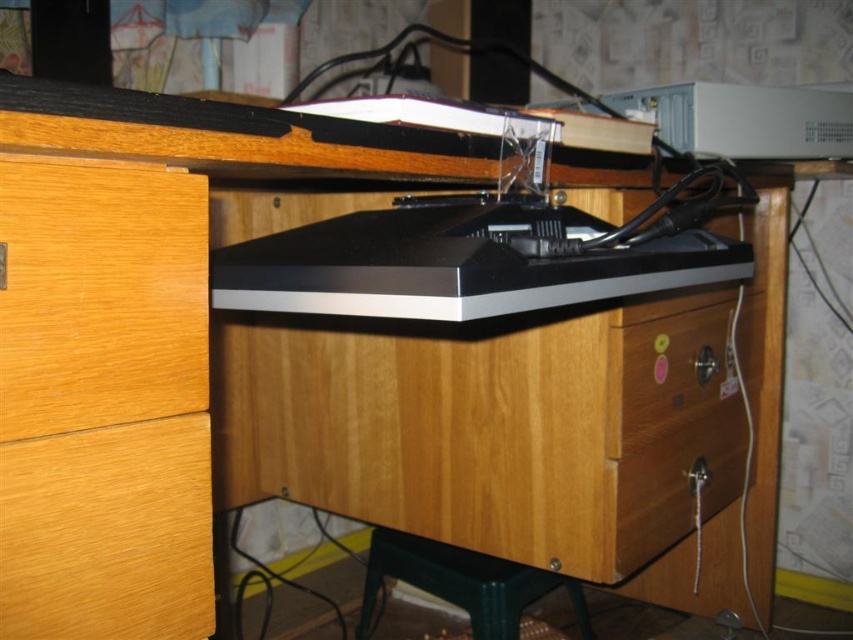
Measure the distance between light wood drawer at lower left and camera.

They are 16.81 inches apart.

From the picture: Does light wood drawer at lower left come behind wooden drawer at lower right?

No, light wood drawer at lower left is closer to the viewer.

Between point (62, 444) and point (668, 454), which one is positioned behind?

The point (668, 454) is behind.

Find the location of a particular element. Image resolution: width=853 pixels, height=640 pixels. light wood drawer at lower left is located at coordinates (107, 532).

Between light wood drawer at left and wooden drawer at lower right, which one has less height?

light wood drawer at left is shorter.

Can you confirm if light wood drawer at left is positioned to the right of wooden drawer at lower right?

No, light wood drawer at left is not to the right of wooden drawer at lower right.

Describe the element at coordinates (100, 296) in the screenshot. I see `light wood drawer at left` at that location.

Find the location of a particular element. This screenshot has width=853, height=640. light wood drawer at left is located at coordinates (100, 296).

Does wooden drawer at center-right come in front of green plastic stool at lower center?

Yes, it is in front of green plastic stool at lower center.

Between point (699, 356) and point (428, 566), which one is positioned in front?

Point (699, 356) is more forward.

Locate an element on the screen. wooden drawer at center-right is located at coordinates click(x=666, y=374).